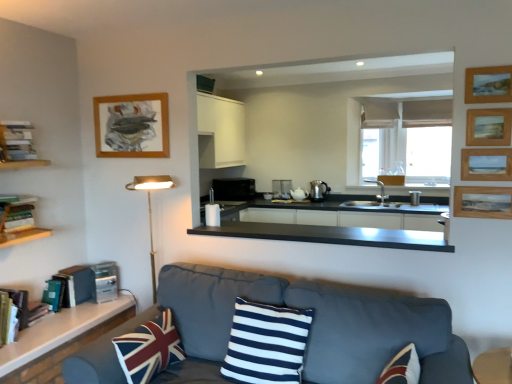
Question: Is white glossy countertop at lower left, which appears as the 2th countertop when viewed from the top, oriented towards wooden textured picture frame at right, which ranks as the second picture frame in back-to-front order?

Choices:
 (A) yes
 (B) no

Answer: (B)

Question: From the image's perspective, is white glossy countertop at lower left, which is counted as the first countertop, starting from the left, above wooden textured picture frame at right, which ranks as the second picture frame in back-to-front order?

Choices:
 (A) no
 (B) yes

Answer: (A)

Question: Is white glossy countertop at lower left, which appears as the 2th countertop when viewed from the top, smaller than wooden textured picture frame at right, the fourth picture frame positioned from the front?

Choices:
 (A) no
 (B) yes

Answer: (A)

Question: Is white glossy countertop at lower left, which appears as the 2th countertop when viewed from the top, at the right side of wooden textured picture frame at right, placed as the 5th picture frame when sorted from left to right?

Choices:
 (A) yes
 (B) no

Answer: (B)

Question: Is white glossy countertop at lower left, which appears as the 2th countertop when viewed from the top, positioned behind wooden textured picture frame at right, acting as the 1th picture frame starting from the right?

Choices:
 (A) no
 (B) yes

Answer: (A)

Question: Based on their sizes in the image, would you say metallic silver toaster at center, positioned as the third appliance in left-to-right order, is bigger or smaller than gold metallic floor lamp at left?

Choices:
 (A) small
 (B) big

Answer: (A)

Question: In terms of height, does metallic silver toaster at center, the second appliance in the bottom-to-top sequence, look taller or shorter compared to gold metallic floor lamp at left?

Choices:
 (A) tall
 (B) short

Answer: (B)

Question: Is metallic silver toaster at center, which ranks as the first appliance in right-to-left order, wider or thinner than gold metallic floor lamp at left?

Choices:
 (A) wide
 (B) thin

Answer: (B)

Question: Relative to gold metallic floor lamp at left, is metallic silver toaster at center, marked as the second appliance in a top-to-bottom arrangement, in front or behind?

Choices:
 (A) front
 (B) behind

Answer: (B)

Question: Choose the correct answer: Is dark gray fabric couch at lower center inside hardcover books at left, which is the first book from front to back, or outside it?

Choices:
 (A) inside
 (B) outside

Answer: (B)

Question: Based on their sizes in the image, would you say dark gray fabric couch at lower center is bigger or smaller than hardcover books at left, acting as the third book starting from the back?

Choices:
 (A) big
 (B) small

Answer: (A)

Question: Is dark gray fabric couch at lower center wider or thinner than hardcover books at left, acting as the third book starting from the back?

Choices:
 (A) wide
 (B) thin

Answer: (A)

Question: Is dark gray fabric couch at lower center in front of or behind hardcover books at left, which is counted as the 3th book, starting from the bottom, in the image?

Choices:
 (A) behind
 (B) front

Answer: (B)

Question: Visually, is hardcover books at left, which is the first book from top to bottom, positioned to the left or to the right of navy blue and white striped cushion at center, positioned as the second pillow in left-to-right order?

Choices:
 (A) right
 (B) left

Answer: (B)

Question: Based on their sizes in the image, would you say hardcover books at left, which is counted as the 3th book, starting from the bottom, is bigger or smaller than navy blue and white striped cushion at center, positioned as the second pillow in left-to-right order?

Choices:
 (A) small
 (B) big

Answer: (A)